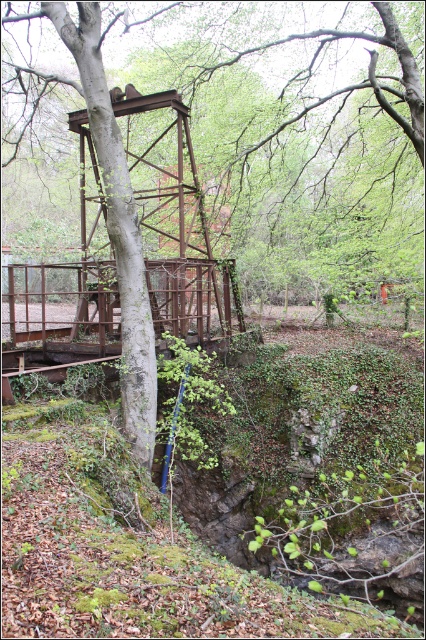
Question: Which point appears farthest from the camera in this image?

Choices:
 (A) (51, 435)
 (B) (112, 304)

Answer: (B)

Question: Is green mossy hillside at lower left wider than rusty metal bridge at center?

Choices:
 (A) yes
 (B) no

Answer: (B)

Question: Can you confirm if green mossy hillside at lower left is bigger than rusty metal bridge at center?

Choices:
 (A) no
 (B) yes

Answer: (A)

Question: Does green mossy hillside at lower left have a lesser width compared to rusty metal bridge at center?

Choices:
 (A) no
 (B) yes

Answer: (B)